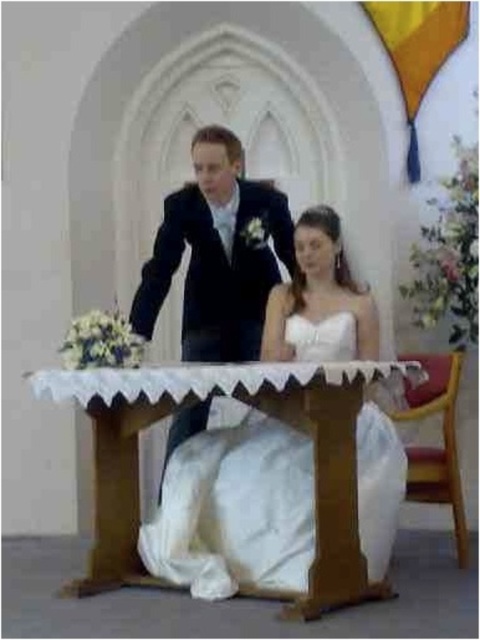
Question: Estimate the real-world distances between objects in this image. Which object is farther from the satin black suit at upper center?

Choices:
 (A) white satin dress at center
 (B) wooden table at center
 (C) white satin wedding dress at center

Answer: (B)

Question: Which point is farther to the camera?

Choices:
 (A) white satin dress at center
 (B) wooden table at center
 (C) satin black suit at upper center

Answer: (C)

Question: Is satin black suit at upper center further to camera compared to white satin dress at center?

Choices:
 (A) yes
 (B) no

Answer: (A)

Question: Is wooden table at center positioned before satin black suit at upper center?

Choices:
 (A) no
 (B) yes

Answer: (B)

Question: Is white satin dress at center to the right of white satin wedding dress at center from the viewer's perspective?

Choices:
 (A) no
 (B) yes

Answer: (B)

Question: Which point is closer to the camera taking this photo?

Choices:
 (A) (124, 561)
 (B) (308, 342)
 (C) (157, 284)

Answer: (B)